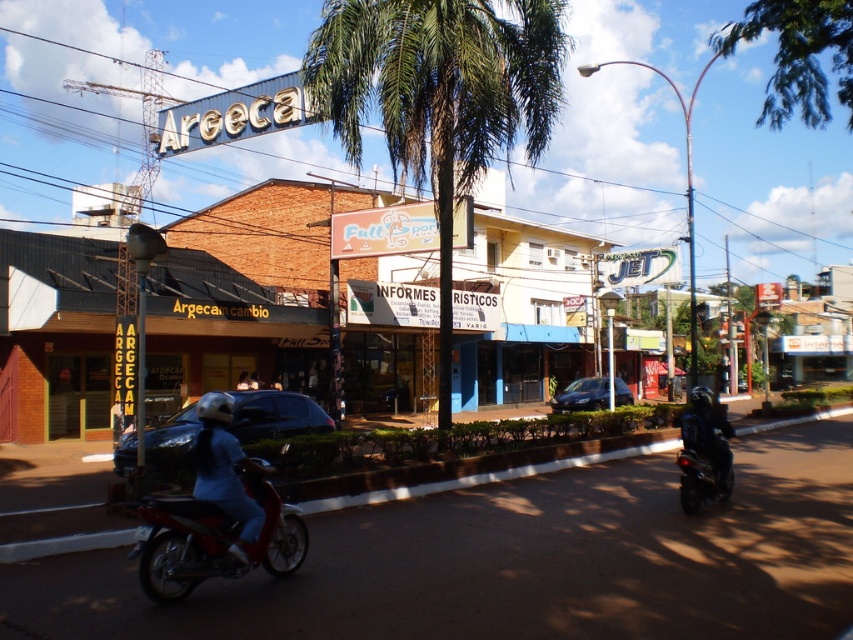
You are a delivery person needing to place the dark blue leather jacket at center on the shiny red motorbike at center. Can the jacket fit vertically on the motorbike without bending it?

The shiny red motorbike at center has a lesser height compared to dark blue leather jacket at center, so the jacket cannot be placed vertically on the motorbike without bending it since the motorbike is shorter than the jacket.

You are a delivery person who needs to place a package on the dark blue leather jacket at center without damaging the green leafy palm tree at center. Is this possible?

The green leafy palm tree at center is located above the dark blue leather jacket at center, so placing the package on the dark blue leather jacket at center won